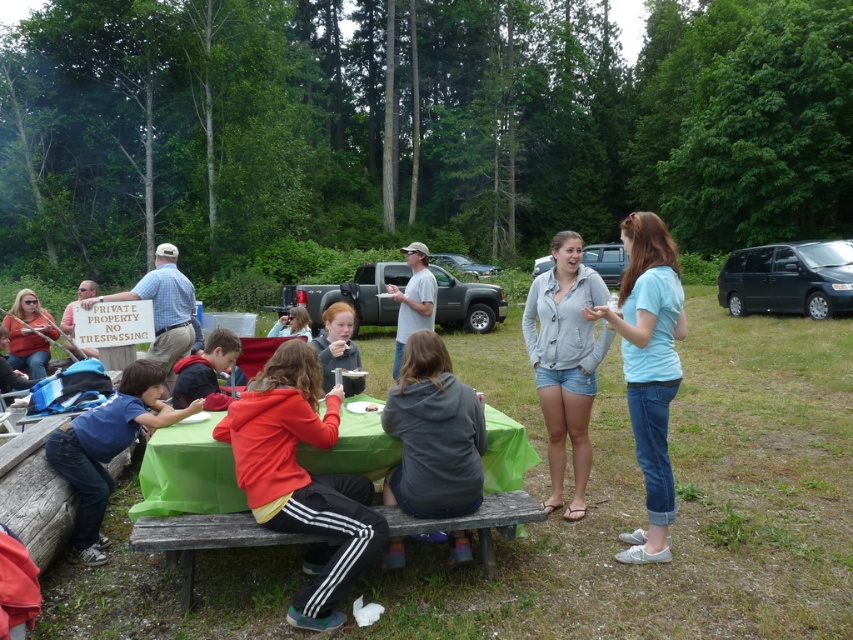
Question: Which point appears farthest from the camera in this image?

Choices:
 (A) (119, 292)
 (B) (399, 369)

Answer: (A)

Question: Which object appears closest to the camera in this image?

Choices:
 (A) white cotton shirt at center
 (B) red hoodie at center

Answer: (B)

Question: Does red fleece jacket at center appear over red hoodie at center?

Choices:
 (A) no
 (B) yes

Answer: (A)

Question: Is red fleece jacket at center positioned behind matte plastic cup at center?

Choices:
 (A) no
 (B) yes

Answer: (A)

Question: Which of the following is the closest to the observer?

Choices:
 (A) (670, 272)
 (B) (128, 384)

Answer: (A)

Question: Is light blue cotton shirt at center wider than blue denim jeans at lower left?

Choices:
 (A) no
 (B) yes

Answer: (A)